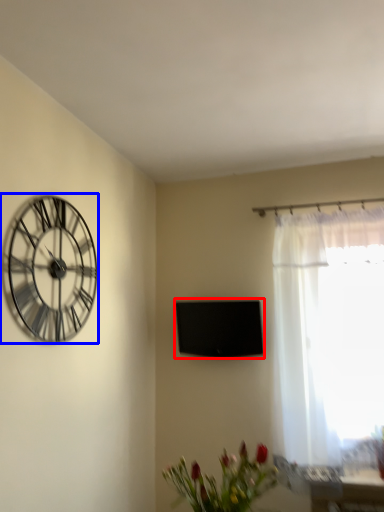
Question: Among these objects, which one is farthest to the camera, window screen (highlighted by a red box) or wall clock (highlighted by a blue box)?

Choices:
 (A) window screen
 (B) wall clock

Answer: (A)